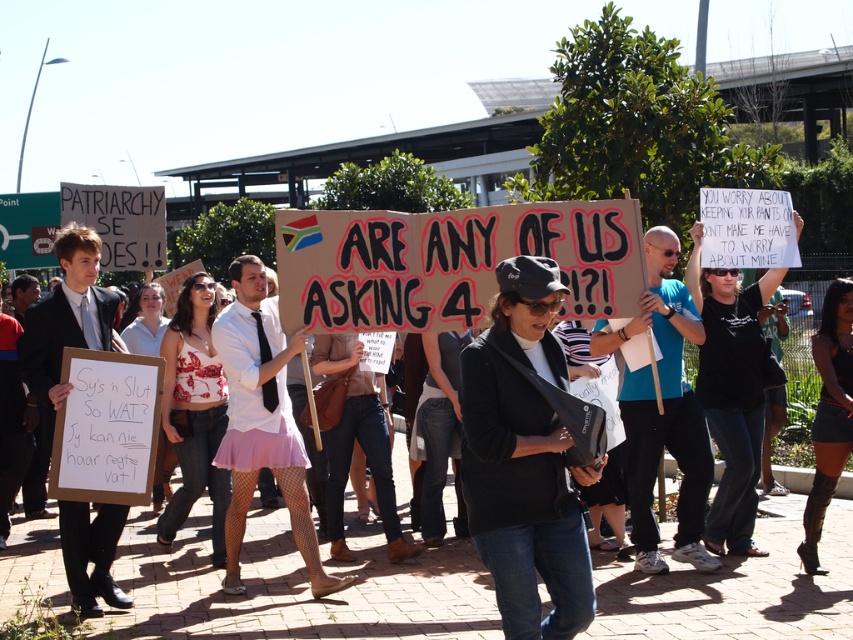
Question: Considering the real-world distances, which object is closest to the black matte jacket at center?

Choices:
 (A) black fabric shirt at center
 (B) blue t-shirt at center

Answer: (B)

Question: Which of the following is the farthest from the observer?

Choices:
 (A) blue t-shirt at center
 (B) black matte jacket at center

Answer: (A)

Question: Does blue t-shirt at center have a greater width compared to black fabric shirt at center?

Choices:
 (A) no
 (B) yes

Answer: (B)

Question: Which is nearer to the black fabric shirt at center?

Choices:
 (A) black matte jacket at center
 (B) blue t-shirt at center

Answer: (B)

Question: Is black matte jacket at center wider than blue t-shirt at center?

Choices:
 (A) no
 (B) yes

Answer: (A)

Question: Where is black matte jacket at center located in relation to black fabric shirt at center in the image?

Choices:
 (A) below
 (B) above

Answer: (A)